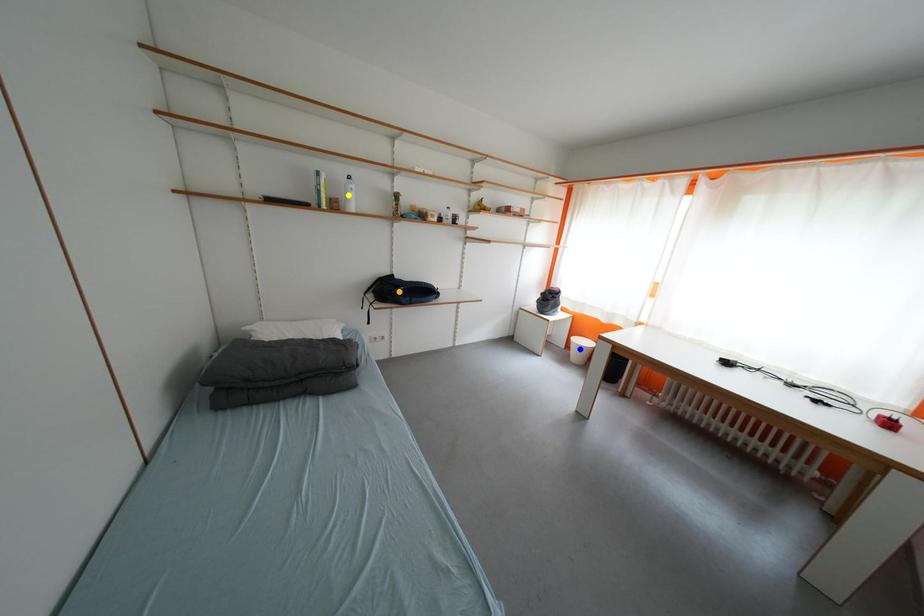
Order these from nearest to farthest:
blue point
orange point
yellow point

yellow point < orange point < blue point